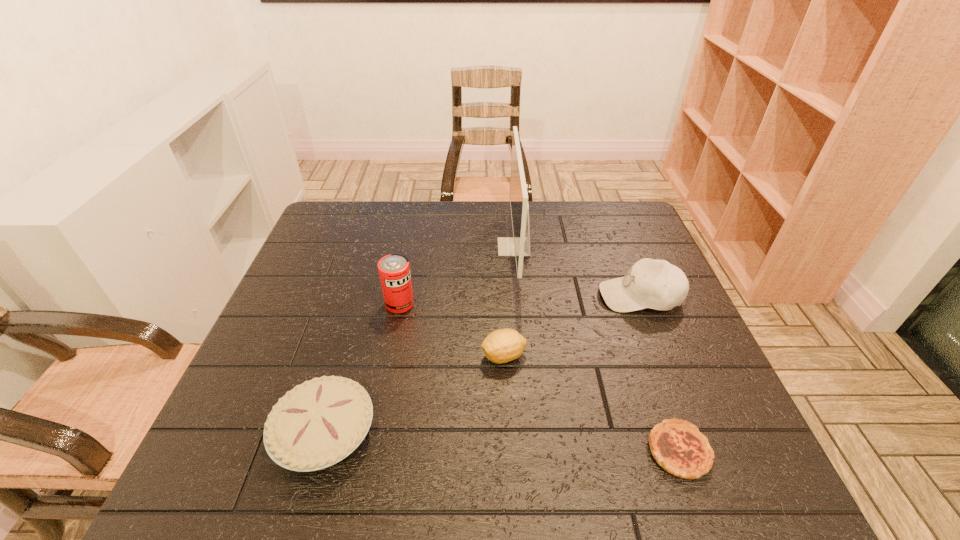
At what (x,y) coordinates should I click in order to perform the action: click on quiche located in the near edge section of the desktop. Please return your answer as a coordinate pair (x, y). The image size is (960, 540). Looking at the image, I should click on (677, 446).

Where is `object positioned at the left edge`? The width and height of the screenshot is (960, 540). object positioned at the left edge is located at coordinates (317, 424).

Where is `baseball cap that is at the right edge`? The width and height of the screenshot is (960, 540). baseball cap that is at the right edge is located at coordinates pos(656,284).

I want to click on quiche that is at the right edge, so click(677, 446).

Image resolution: width=960 pixels, height=540 pixels. I want to click on object located at the near left corner, so click(317, 424).

Find the location of a particular element. object positioned at the near right corner is located at coordinates (677, 446).

Find the location of a particular element. This screenshot has height=540, width=960. vacant space at the far edge of the desktop is located at coordinates (562, 217).

Identify the location of vacant area at the near edge of the desktop. This screenshot has height=540, width=960. (561, 455).

In the image, there is a desktop. Where is `vacant space at the right edge`? vacant space at the right edge is located at coordinates (639, 356).

At what (x,y) coordinates should I click in order to perform the action: click on vacant space at the far left corner. Please return your answer as a coordinate pair (x, y). The image size is (960, 540). Looking at the image, I should click on (356, 236).